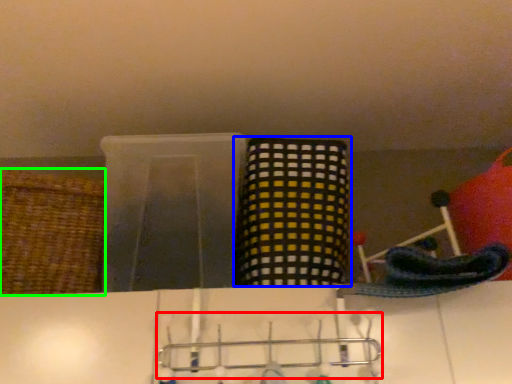
Question: Which is nearer to the hanger (highlighted by a red box)? basket (highlighted by a blue box) or basket (highlighted by a green box).

Choices:
 (A) basket
 (B) basket

Answer: (A)